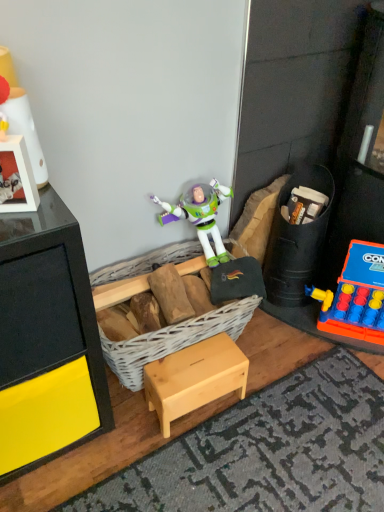
Find the location of a particular element. blank space to the left of rubberized plastic game at right, which appears as the 2th toy when viewed from the back is located at coordinates (288, 333).